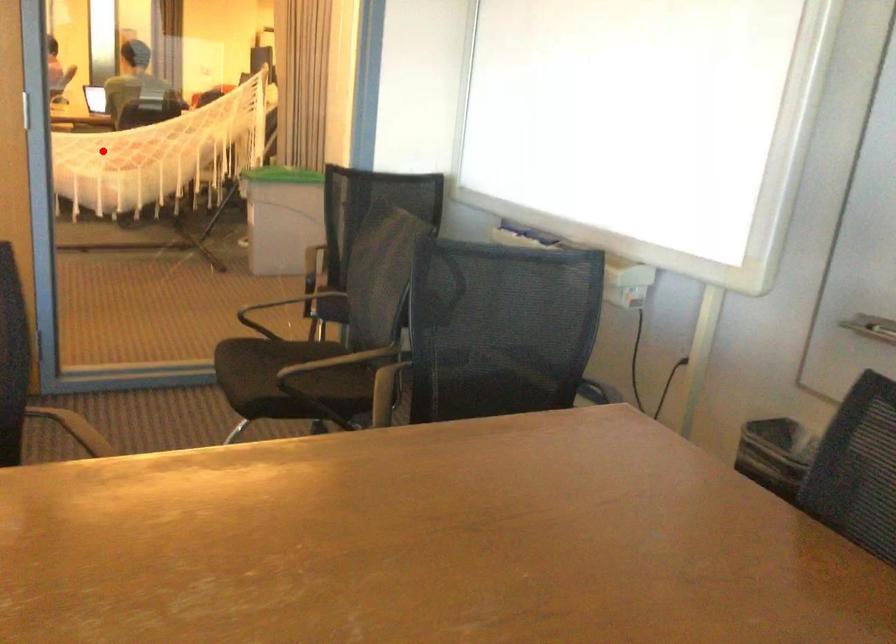
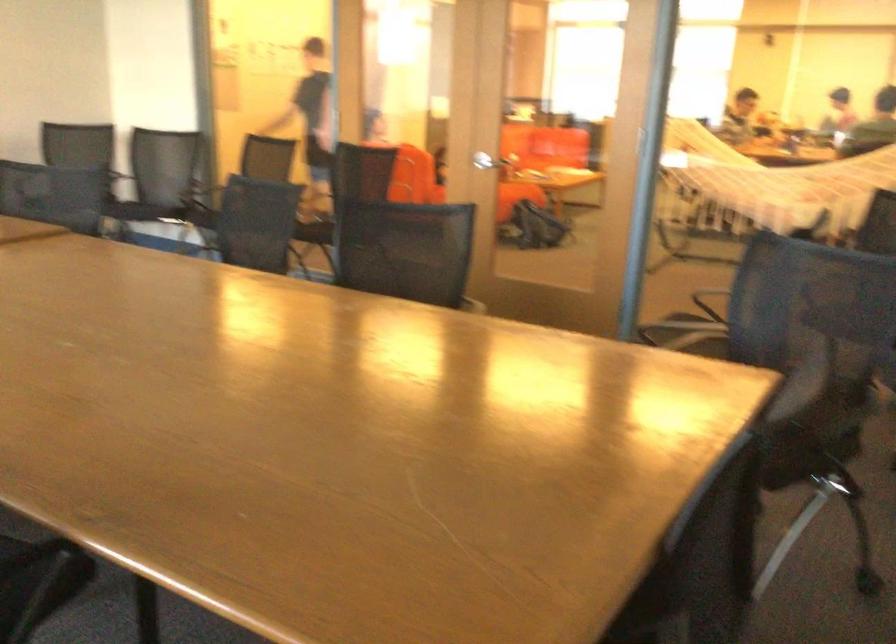
Question: I am providing you with two images of the same scene from different viewpoints. A red point is marked on the first image. At the location where the point appears in image 1, is it still visible in image 2?

Choices:
 (A) Yes
 (B) No

Answer: (A)